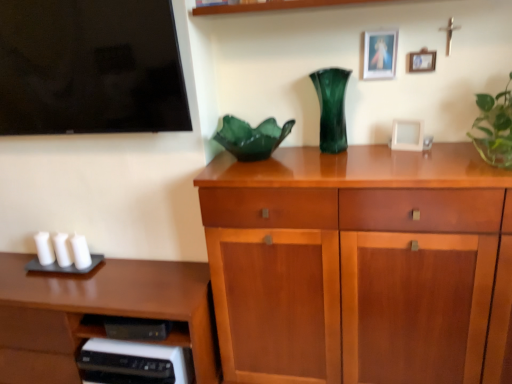
How much space does matte gold picture frame at upper right, the 3th picture frame ordered from the bottom, occupy horizontally?

matte gold picture frame at upper right, the 3th picture frame ordered from the bottom, is 1.25 inches in width.

Find the location of a particular element. This screenshot has width=512, height=384. matte gold picture frame at upper right, the first picture frame from the top is located at coordinates (380, 54).

What are the coordinates of `green glass vase at center` in the screenshot? It's located at (331, 108).

Find the location of a particular element. Image resolution: width=512 pixels, height=384 pixels. white matte picture frame at upper right, marked as the 1th picture frame in a bottom-to-top arrangement is located at coordinates coord(407,135).

You are a GUI agent. You are given a task and a screenshot of the screen. Output one action in this format:
    pyautogui.click(x=<x>, y=<y>)
    Task: Click on the wooden cabinet at center
    Image resolution: width=512 pixels, height=384 pixels.
    Given the screenshot: What is the action you would take?
    pyautogui.click(x=355, y=263)

Is green glass bowl at center, which ranks as the 1th houseplant in left-to-right order, to the left of matte white picture frame at upper right, the 2th picture frame positioned from the bottom, from the viewer's perspective?

Indeed, green glass bowl at center, which ranks as the 1th houseplant in left-to-right order, is positioned on the left side of matte white picture frame at upper right, the 2th picture frame positioned from the bottom.

Does point (269, 118) lie behind point (423, 50)?

That is True.

Does green glass bowl at center, which ranks as the 1th houseplant in left-to-right order, have a greater width compared to matte white picture frame at upper right, arranged as the 2th picture frame when viewed from the top?

Yes.

Is white matte picture frame at upper right, which is counted as the third picture frame, starting from the top, to the left or to the right of green glossy plant at right, which is the second houseplant in left-to-right order, in the image?

Clearly, white matte picture frame at upper right, which is counted as the third picture frame, starting from the top, is on the left of green glossy plant at right, which is the second houseplant in left-to-right order, in the image.

Looking at the image, does white matte picture frame at upper right, which is counted as the third picture frame, starting from the top, seem bigger or smaller compared to green glossy plant at right, which is the second houseplant in left-to-right order?

In the image, white matte picture frame at upper right, which is counted as the third picture frame, starting from the top, appears to be smaller than green glossy plant at right, which is the second houseplant in left-to-right order.

Would you say white matte picture frame at upper right, which is counted as the third picture frame, starting from the top, is a long distance from green glossy plant at right, which is the second houseplant in left-to-right order?

They are positioned close to each other.

Find the location of a particular element. the 2nd houseplant in front of the white matte picture frame at upper right, which is counted as the third picture frame, starting from the top is located at coordinates (494, 128).

Could you tell me if matte gold picture frame at upper right, the 3th picture frame ordered from the bottom, is turned towards green glass bowl at center, which ranks as the 1th houseplant in left-to-right order?

No, matte gold picture frame at upper right, the 3th picture frame ordered from the bottom, is not oriented towards green glass bowl at center, which ranks as the 1th houseplant in left-to-right order.

Is matte gold picture frame at upper right, the first picture frame from the top, beside green glass bowl at center, arranged as the 2th houseplant when viewed from the right?

No.

Which is more to the right, matte gold picture frame at upper right, the first picture frame from the top, or green glass bowl at center, which ranks as the 1th houseplant in left-to-right order?

matte gold picture frame at upper right, the first picture frame from the top, is more to the right.

In the scene shown: Considering the relative sizes of matte gold picture frame at upper right, the 3th picture frame ordered from the bottom, and green glass bowl at center, which ranks as the 1th houseplant in left-to-right order, in the image provided, is matte gold picture frame at upper right, the 3th picture frame ordered from the bottom, smaller than green glass bowl at center, which ranks as the 1th houseplant in left-to-right order,?

Yes, matte gold picture frame at upper right, the 3th picture frame ordered from the bottom, is smaller than green glass bowl at center, which ranks as the 1th houseplant in left-to-right order.

Does point (58, 235) come closer to viewer compared to point (42, 240)?

No, (58, 235) is further to viewer.

Considering the sizes of objects white matte candle at left, which is the 2th candle in right-to-left order, and white matte candle at lower left, which appears as the first candle when viewed from the left, in the image provided, who is taller, white matte candle at left, which is the 2th candle in right-to-left order, or white matte candle at lower left, which appears as the first candle when viewed from the left,?

white matte candle at lower left, which appears as the first candle when viewed from the left.

Looking at this image, between white matte candle at left, which is the 2th candle in right-to-left order, and white matte candle at lower left, which appears as the first candle when viewed from the left, which one appears on the left side from the viewer's perspective?

white matte candle at lower left, which appears as the first candle when viewed from the left, is more to the left.

Is point (421, 59) closer or farther from the camera than point (84, 250)?

Point (421, 59).

From the image's perspective, between matte white picture frame at upper right, arranged as the 2th picture frame when viewed from the top, and white matte candle at left, acting as the first candle starting from the right, who is located below?

white matte candle at left, acting as the first candle starting from the right, from the image's perspective.

Consider the image. Considering the positions of objects matte white picture frame at upper right, arranged as the 2th picture frame when viewed from the top, and white matte candle at left, acting as the first candle starting from the right, in the image provided, who is behind, matte white picture frame at upper right, arranged as the 2th picture frame when viewed from the top, or white matte candle at left, acting as the first candle starting from the right,?

white matte candle at left, acting as the first candle starting from the right, is further from the camera.

Between matte white picture frame at upper right, arranged as the 2th picture frame when viewed from the top, and white matte candle at left, which is counted as the third candle, starting from the left, which one appears on the left side from the viewer's perspective?

Positioned to the left is white matte candle at left, which is counted as the third candle, starting from the left.

Can you tell me how much white matte candle at left, which is counted as the third candle, starting from the left, and brown wood desk at lower left differ in facing direction?

They differ by 0.761 degrees in their facing directions.

Considering the relative positions of white matte candle at left, which is counted as the third candle, starting from the left, and brown wood desk at lower left in the image provided, is white matte candle at left, which is counted as the third candle, starting from the left, to the right of brown wood desk at lower left from the viewer's perspective?

Correct, you'll find white matte candle at left, which is counted as the third candle, starting from the left, to the right of brown wood desk at lower left.

Looking at their sizes, would you say white matte candle at left, which is counted as the third candle, starting from the left, is wider or thinner than brown wood desk at lower left?

Considering their sizes, white matte candle at left, which is counted as the third candle, starting from the left, looks slimmer than brown wood desk at lower left.

From a real-world perspective, which is physically below, white matte candle at left, acting as the first candle starting from the right, or brown wood desk at lower left?

brown wood desk at lower left.

How much distance is there between green glass vase at center and brown wood desk at lower left?

green glass vase at center and brown wood desk at lower left are 3.48 feet apart from each other.

Does green glass vase at center have a greater width compared to brown wood desk at lower left?

No.

Which object is positioned more to the right, green glass vase at center or brown wood desk at lower left?

Positioned to the right is green glass vase at center.

Between green glass vase at center and brown wood desk at lower left, which one has more height?

With more height is brown wood desk at lower left.

Locate an element on the screen. Image resolution: width=512 pixels, height=384 pixels. the 1st houseplant in front of the matte white picture frame at upper right, the 2th picture frame positioned from the bottom is located at coordinates (252, 138).

This screenshot has height=384, width=512. In order to click on houseplant on the right of white matte picture frame at upper right, which is counted as the third picture frame, starting from the top in this screenshot , I will do pyautogui.click(x=494, y=128).

Considering their positions, is green glossy plant at right, arranged as the 1th houseplant when viewed from the right, positioned closer to white matte candle at lower left, which appears as the first candle when viewed from the left, than white matte picture frame at upper right, marked as the 1th picture frame in a bottom-to-top arrangement?

white matte picture frame at upper right, marked as the 1th picture frame in a bottom-to-top arrangement, lies closer to white matte candle at lower left, which appears as the first candle when viewed from the left, than the other object.

From the image, which object appears to be nearer to white matte candle at left, which is the 2th candle in right-to-left order, green glass vase at center or matte white picture frame at upper right, the 2th picture frame positioned from the bottom?

green glass vase at center is positioned closer to the anchor white matte candle at left, which is the 2th candle in right-to-left order.

Considering their positions, is white matte candle at lower left, the 3th candle in the right-to-left sequence, positioned further to white matte picture frame at upper right, which is counted as the third picture frame, starting from the top, than wooden cabinet at center?

Among the two, white matte candle at lower left, the 3th candle in the right-to-left sequence, is located further to white matte picture frame at upper right, which is counted as the third picture frame, starting from the top.

Which object lies further to the anchor point green glossy plant at right, which is the second houseplant in left-to-right order, white matte candle at left, the second candle viewed from the left, or white matte candle at lower left, the 3th candle in the right-to-left sequence?

white matte candle at lower left, the 3th candle in the right-to-left sequence, is positioned further to the anchor green glossy plant at right, which is the second houseplant in left-to-right order.

Estimate the real-world distances between objects in this image. Which object is further from brown wood desk at lower left, white matte candle at left, acting as the first candle starting from the right, or matte white picture frame at upper right, arranged as the 2th picture frame when viewed from the top?

matte white picture frame at upper right, arranged as the 2th picture frame when viewed from the top, is positioned further to the anchor brown wood desk at lower left.

From the image, which object appears to be farther from white matte candle at lower left, which appears as the first candle when viewed from the left, matte gold picture frame at upper right, the 3th picture frame ordered from the bottom, or green glass bowl at center, which ranks as the 1th houseplant in left-to-right order?

Based on the image, matte gold picture frame at upper right, the 3th picture frame ordered from the bottom, appears to be further to white matte candle at lower left, which appears as the first candle when viewed from the left.

In the scene shown: Which object lies nearer to the anchor point matte gold picture frame at upper right, the 3th picture frame ordered from the bottom, matte white picture frame at upper right, arranged as the 2th picture frame when viewed from the top, or green glossy plant at right, which is the second houseplant in left-to-right order?

Among the two, matte white picture frame at upper right, arranged as the 2th picture frame when viewed from the top, is located nearer to matte gold picture frame at upper right, the 3th picture frame ordered from the bottom.

When comparing their distances from green glossy plant at right, which is the second houseplant in left-to-right order, does matte white picture frame at upper right, the 2th picture frame positioned from the bottom, or white matte candle at lower left, the 3th candle in the right-to-left sequence, seem further?

The object further to green glossy plant at right, which is the second houseplant in left-to-right order, is white matte candle at lower left, the 3th candle in the right-to-left sequence.

Identify the location of picture frame between white matte candle at left, acting as the first candle starting from the right, and white matte picture frame at upper right, which is counted as the third picture frame, starting from the top, from left to right. (380, 54).

Find the location of a particular element. The width and height of the screenshot is (512, 384). picture frame between matte white picture frame at upper right, arranged as the 2th picture frame when viewed from the top, and wooden cabinet at center, in the vertical direction is located at coordinates (407, 135).

Locate an element on the screen. desk located between white matte candle at lower left, which appears as the first candle when viewed from the left, and green glass vase at center in the left-right direction is located at coordinates (99, 313).

This screenshot has height=384, width=512. Identify the location of picture frame situated between white matte candle at left, the second candle viewed from the left, and white matte picture frame at upper right, marked as the 1th picture frame in a bottom-to-top arrangement, from left to right. (380, 54).